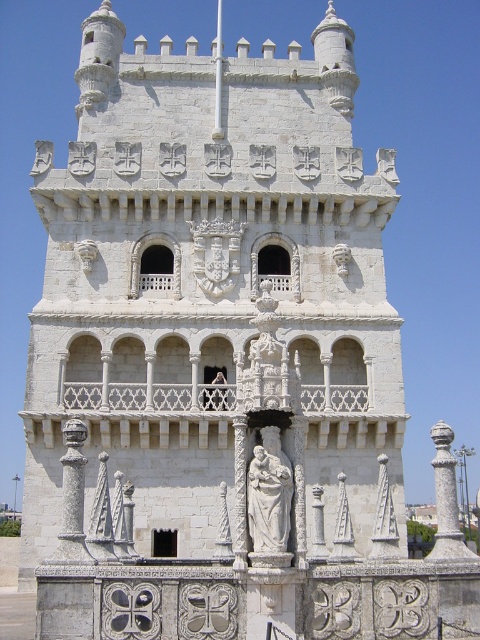
Question: Which of the following is the closest to the observer?

Choices:
 (A) (288, 465)
 (B) (382, 524)

Answer: (A)

Question: Which object appears farthest from the camera in this image?

Choices:
 (A) white marble statue at center
 (B) white stone statue at center

Answer: (B)

Question: Which of the following is the farthest from the observer?

Choices:
 (A) white marble statue at center
 (B) white stone statue at center

Answer: (B)

Question: Does white marble statue at center have a larger size compared to white stone statue at center?

Choices:
 (A) no
 (B) yes

Answer: (A)

Question: From the image, what is the correct spatial relationship of white marble statue at center in relation to white stone statue at center?

Choices:
 (A) left
 (B) right

Answer: (A)

Question: Observing the image, what is the correct spatial positioning of white marble statue at center in reference to white stone statue at center?

Choices:
 (A) above
 (B) below

Answer: (A)